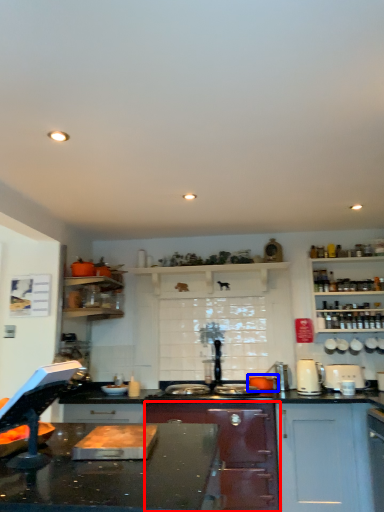
Question: Among these objects, which one is nearest to the camera, cabinetry (highlighted by a red box) or appliance (highlighted by a blue box)?

Choices:
 (A) cabinetry
 (B) appliance

Answer: (A)